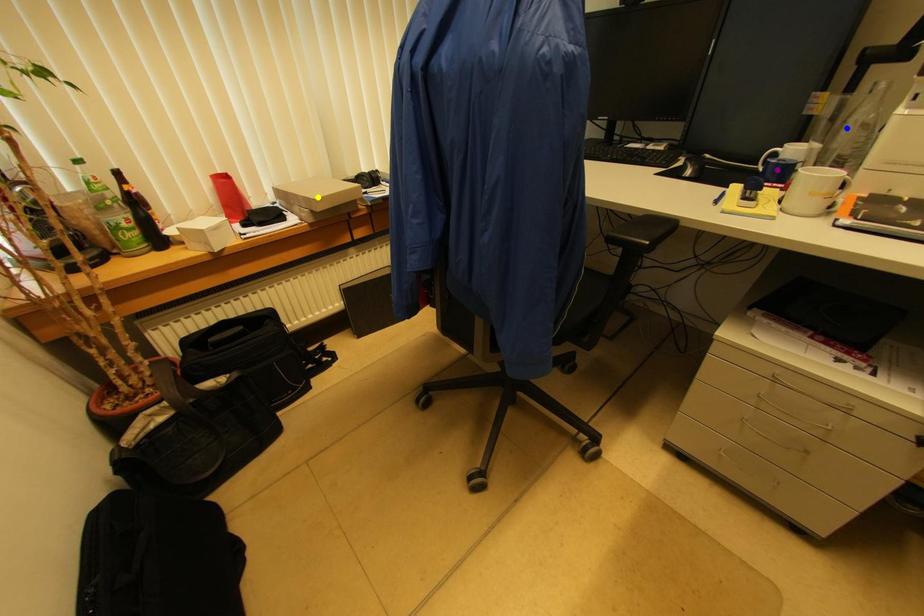
Order these from nearest to farthest:
1. blue point
2. purple point
3. yellow point

1. blue point
2. purple point
3. yellow point